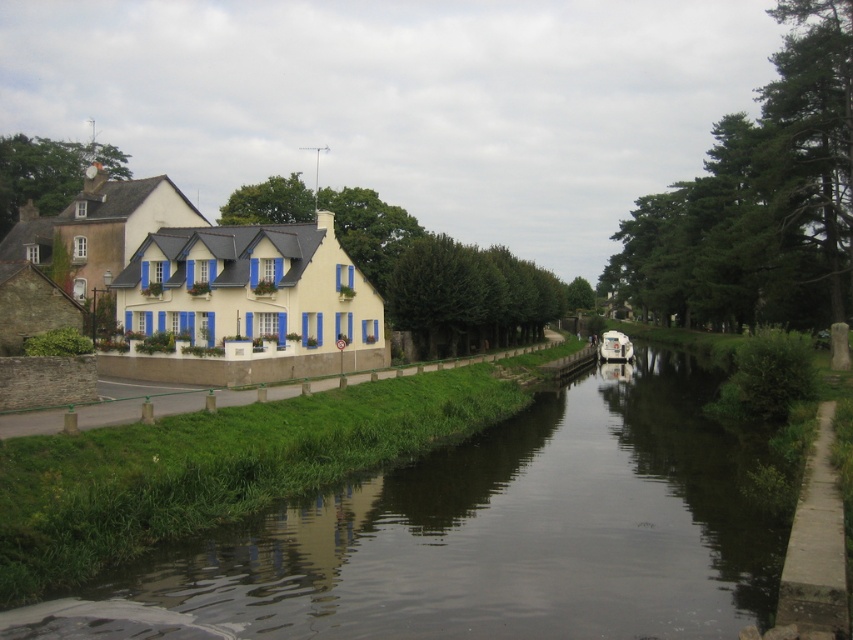
You are standing on the grassy bank of the smooth concrete canal at center and want to reach the white glossy boat at center. Which direction should you move to get closer to the boat?

Since the smooth concrete canal at center is in front of the white glossy boat at center, you should move backward to get closer to the boat.

You are a painter standing on the right bank of the canal. You want to paint both the smooth concrete canal at center and the white painted wall at left. Which object should you focus on first if you want to paint the wider one first?

The smooth concrete canal at center is wider than the white painted wall at left, so you should focus on painting the smooth concrete canal at center first.

You are standing on the left bank of the canal and want to reach the white glossy boat at center. The smooth concrete canal at center is between you and the boat. If you can only walk on solid ground, which direction should you go to avoid the canal?

Since the smooth concrete canal at center is between you and the white glossy boat at center, you need to go around it. However, the description does not provide information about the presence of bridges or pathways around the canal, so it is unclear which direction to go. Please check the surroundings for a bridge or path leading to the boat.